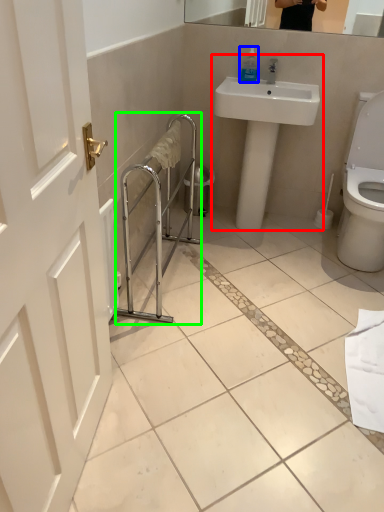
Question: Considering the real-world distances, which object is farthest from sink (highlighted by a red box)? soap dispenser (highlighted by a blue box) or balustrade (highlighted by a green box)?

Choices:
 (A) soap dispenser
 (B) balustrade

Answer: (B)